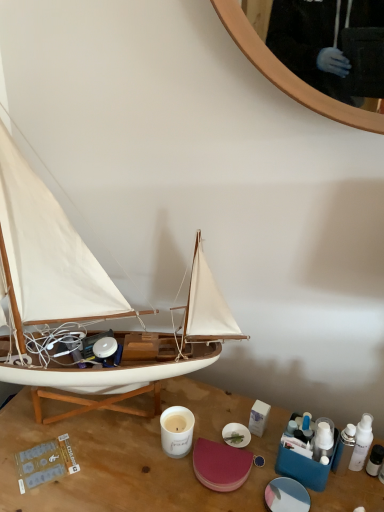
The image size is (384, 512). Identify the location of blank space situated above wooden desk at center (from a real-world perspective). (155, 451).